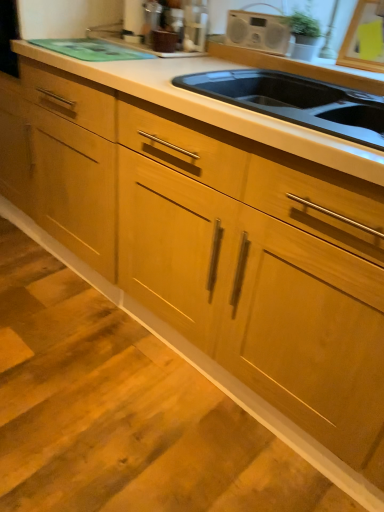
The image size is (384, 512). What do you see at coordinates (194, 25) in the screenshot? I see `metallic silver toaster at upper center` at bounding box center [194, 25].

In order to face metallic silver toaster at upper center, should I rotate leftwards or rightwards?

A 0.200 degree turn to the right will do.

Identify the location of metallic silver toaster at upper center. The width and height of the screenshot is (384, 512). (194, 25).

Measure the distance between point (189, 46) and camera.

The distance of point (189, 46) from camera is 1.61 meters.

This screenshot has width=384, height=512. What do you see at coordinates (296, 101) in the screenshot?
I see `black matte sink at center` at bounding box center [296, 101].

At what (x,y) coordinates should I click in order to perform the action: click on black matte sink at center. Please return your answer as a coordinate pair (x, y). Looking at the image, I should click on (296, 101).

Find the location of a particular element. metallic silver toaster at upper center is located at coordinates click(x=194, y=25).

Is metallic silver toaster at upper center to the left or to the right of black matte sink at center in the image?

In the image, metallic silver toaster at upper center appears on the left side of black matte sink at center.

Is metallic silver toaster at upper center positioned in front of black matte sink at center?

No, it is behind black matte sink at center.

Which is behind, point (184, 37) or point (244, 105)?

Positioned behind is point (184, 37).

From the image's perspective, is metallic silver toaster at upper center below black matte sink at center?

Incorrect, from the image's perspective, metallic silver toaster at upper center is higher than black matte sink at center.

From a real-world perspective, is metallic silver toaster at upper center positioned above or below black matte sink at center?

From a real-world perspective, metallic silver toaster at upper center is physically above black matte sink at center.

Considering the sizes of objects metallic silver toaster at upper center and black matte sink at center in the image provided, who is wider, metallic silver toaster at upper center or black matte sink at center?

black matte sink at center.

Which of these two, metallic silver toaster at upper center or black matte sink at center, stands shorter?

black matte sink at center.

Who is smaller, metallic silver toaster at upper center or black matte sink at center?

With smaller size is metallic silver toaster at upper center.

Is metallic silver toaster at upper center spatially inside black matte sink at center, or outside of it?

metallic silver toaster at upper center is not inside black matte sink at center, it's outside.

Would you consider metallic silver toaster at upper center to be distant from black matte sink at center?

Actually, metallic silver toaster at upper center and black matte sink at center are a little close together.

Is metallic silver toaster at upper center positioned with its back to black matte sink at center?

No.

Where is `appliance located above the black matte sink at center (from the image's perspective)`? appliance located above the black matte sink at center (from the image's perspective) is located at coordinates (194, 25).

Based on the photo, is black matte sink at center at the right side of metallic silver toaster at upper center?

Yes.

Is black matte sink at center in front of or behind metallic silver toaster at upper center in the image?

black matte sink at center is positioned closer to the viewer than metallic silver toaster at upper center.

Which is closer, (x=319, y=109) or (x=190, y=15)?

Point (x=319, y=109) appears to be closer to the viewer than point (x=190, y=15).

From the image's perspective, between black matte sink at center and metallic silver toaster at upper center, who is located below?

black matte sink at center, from the image's perspective.

From a real-world perspective, is black matte sink at center positioned above or below metallic silver toaster at upper center?

From a real-world perspective, black matte sink at center is physically below metallic silver toaster at upper center.

Between black matte sink at center and metallic silver toaster at upper center, which one has smaller width?

With smaller width is metallic silver toaster at upper center.

Is black matte sink at center shorter than metallic silver toaster at upper center?

Indeed, black matte sink at center has a lesser height compared to metallic silver toaster at upper center.

Considering the sizes of objects black matte sink at center and metallic silver toaster at upper center in the image provided, who is bigger, black matte sink at center or metallic silver toaster at upper center?

black matte sink at center is bigger.

Can we say black matte sink at center lies outside metallic silver toaster at upper center?

Absolutely, black matte sink at center is external to metallic silver toaster at upper center.

Is black matte sink at center far from metallic silver toaster at upper center?

No.

Is black matte sink at center facing away from metallic silver toaster at upper center?

No.

What's the angular difference between black matte sink at center and metallic silver toaster at upper center's facing directions?

1.59 degrees separate the facing orientations of black matte sink at center and metallic silver toaster at upper center.

Where is `appliance behind the black matte sink at center`? This screenshot has height=512, width=384. appliance behind the black matte sink at center is located at coordinates (194, 25).

Locate an element on the screen. The width and height of the screenshot is (384, 512). sink in front of the metallic silver toaster at upper center is located at coordinates (296, 101).

The height and width of the screenshot is (512, 384). Identify the location of appliance located above the black matte sink at center (from the image's perspective). (194, 25).